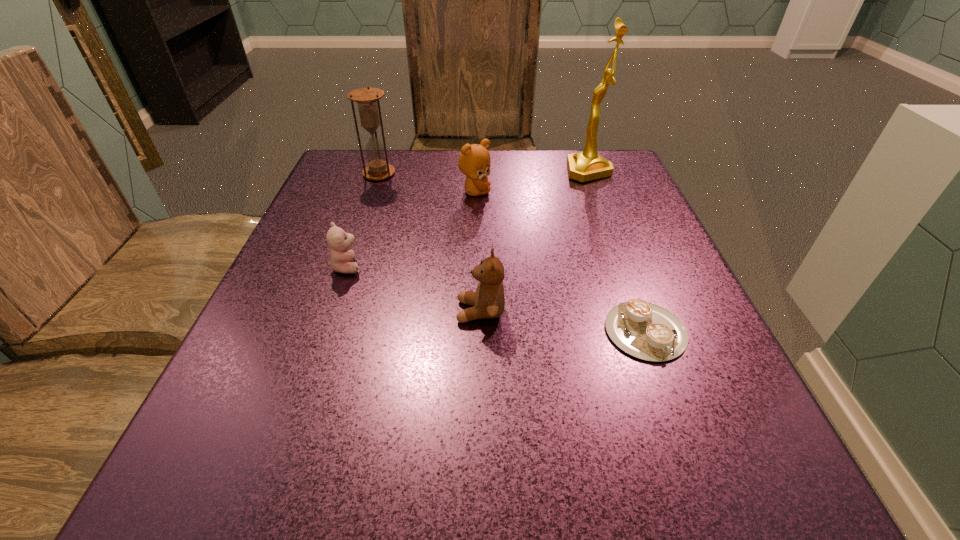
Locate an element on the screen. This screenshot has width=960, height=540. vacant space at the far right corner is located at coordinates (606, 191).

This screenshot has width=960, height=540. In order to click on free space at the near right corner of the desktop in this screenshot , I will do `click(682, 469)`.

Where is `empty space between the second tallest object and the cappuccino`? empty space between the second tallest object and the cappuccino is located at coordinates (512, 252).

This screenshot has height=540, width=960. I want to click on vacant area that lies between the nearest teddy bear and the third farthest object, so click(478, 252).

Where is `blank region between the nearest teddy bear and the third farthest object`? The height and width of the screenshot is (540, 960). blank region between the nearest teddy bear and the third farthest object is located at coordinates (478, 252).

Find the location of a particular element. Image resolution: width=960 pixels, height=540 pixels. free space between the fifth shortest object and the nearest teddy bear is located at coordinates (430, 242).

This screenshot has height=540, width=960. What are the coordinates of `vacant region between the fourth nearest object and the nearest teddy bear` in the screenshot? It's located at (478, 252).

Locate an element on the screen. Image resolution: width=960 pixels, height=540 pixels. vacant region between the fourth nearest object and the shortest object is located at coordinates (560, 261).

Locate an element on the screen. unoccupied area between the fourth nearest object and the nearest teddy bear is located at coordinates (478, 252).

Find the location of a particular element. The width and height of the screenshot is (960, 540). vacant space that's between the nearest teddy bear and the second tallest object is located at coordinates (430, 242).